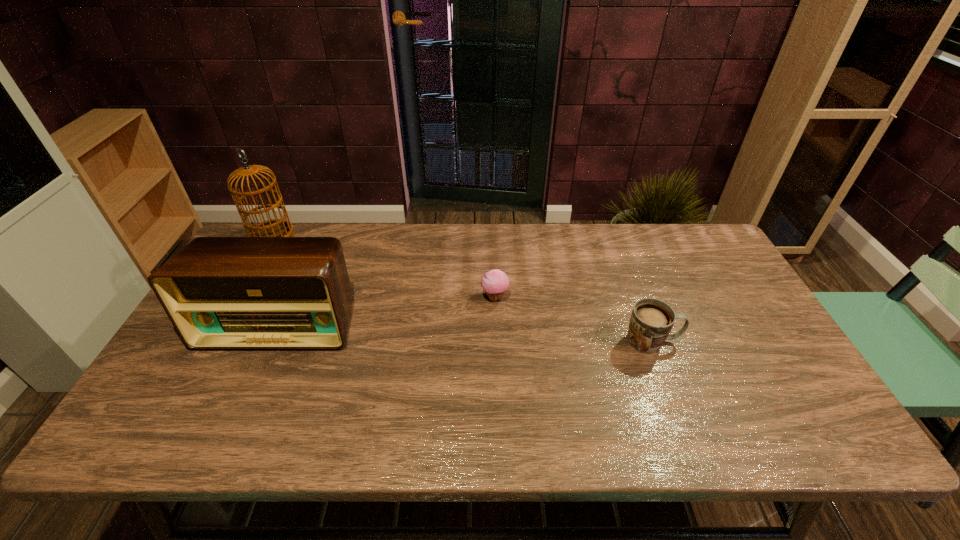
Image resolution: width=960 pixels, height=540 pixels. What are the coordinates of `empty space that is in between the third shortest object and the shortest object` in the screenshot? It's located at (387, 310).

You are a GUI agent. You are given a task and a screenshot of the screen. Output one action in this format:
    pyautogui.click(x=<x>, y=<y>)
    Task: Click on the free point between the second tallest object and the shortest object
    The image size is (960, 540).
    Given the screenshot: What is the action you would take?
    pyautogui.click(x=387, y=310)

Where is `free area in between the third shortest object and the second object from right to left`? The image size is (960, 540). free area in between the third shortest object and the second object from right to left is located at coordinates (387, 310).

Identify the location of vacant area between the second shortest object and the farthest object. (463, 289).

What are the coordinates of `free spot between the third tallest object and the shortest object` in the screenshot? It's located at (573, 319).

The image size is (960, 540). I want to click on blank region between the mug and the tallest object, so click(463, 289).

Locate an element on the screen. vacant area that lies between the rightmost object and the farthest object is located at coordinates (463, 289).

You are a GUI agent. You are given a task and a screenshot of the screen. Output one action in this format:
    pyautogui.click(x=<x>, y=<y>)
    Task: Click on the free spot between the radio receiver and the cupcake
    
    Given the screenshot: What is the action you would take?
    pyautogui.click(x=387, y=310)

Identify which object is located as the third nearest to the birdcage. Please provide its 2D coordinates. Your answer should be formatted as a tuple, i.e. [(x, y)], where the tuple contains the x and y coordinates of a point satisfying the conditions above.

[(651, 321)]

This screenshot has height=540, width=960. Identify the location of object that stands as the second closest to the tallest object. (495, 282).